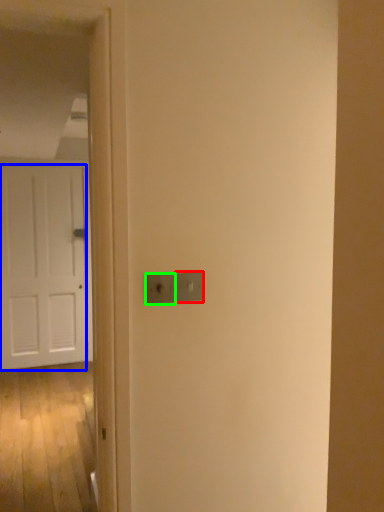
Question: Based on their relative distances, which object is nearer to light switch (highlighted by a red box)? Choose from door (highlighted by a blue box) and light switch (highlighted by a green box).

Choices:
 (A) door
 (B) light switch

Answer: (B)